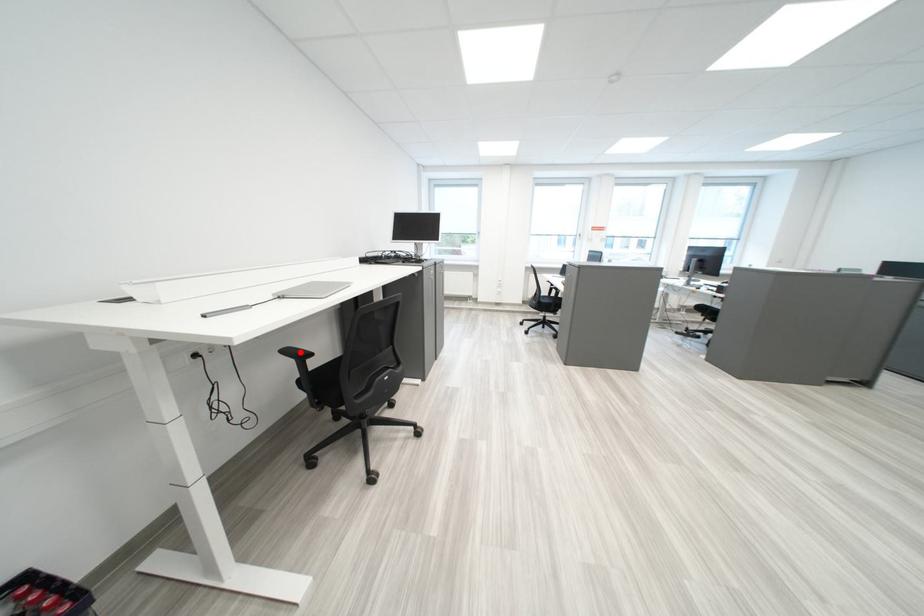
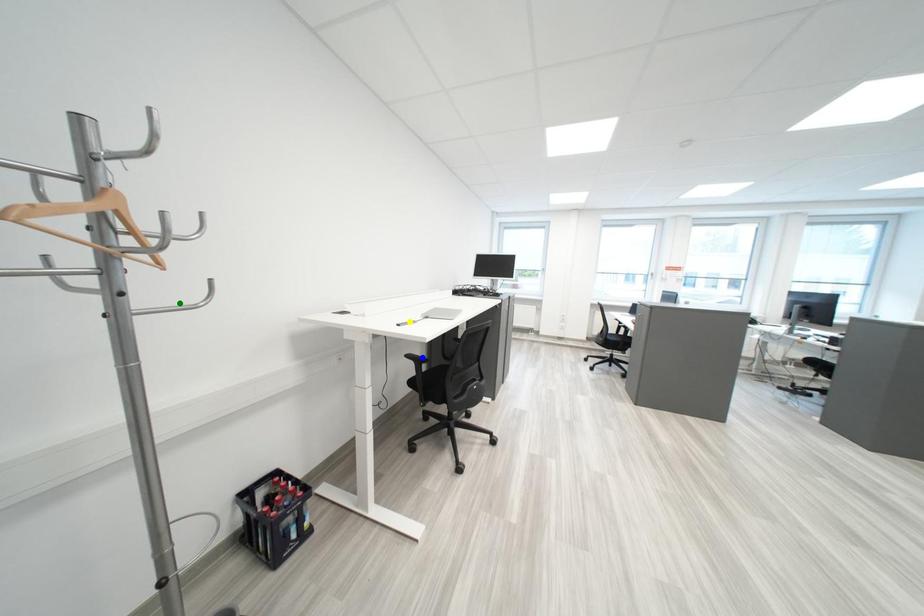
Question: I am providing you with two images of the same scene from different viewpoints. A red point is marked on the first image. You are given multiple points on the second image. Which mark in image 2 goes with the point in image 1?

Choices:
 (A) yellow point
 (B) green point
 (C) blue point

Answer: (C)